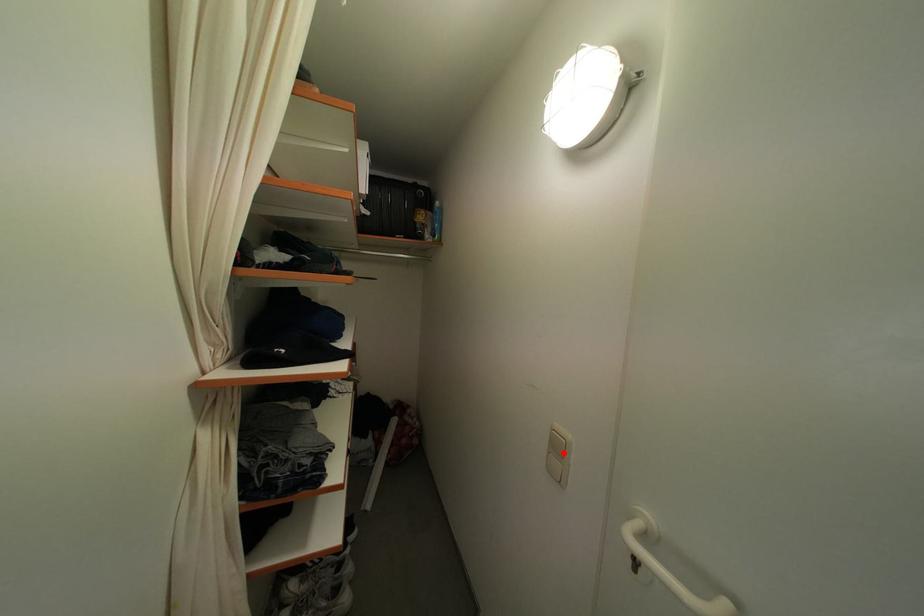
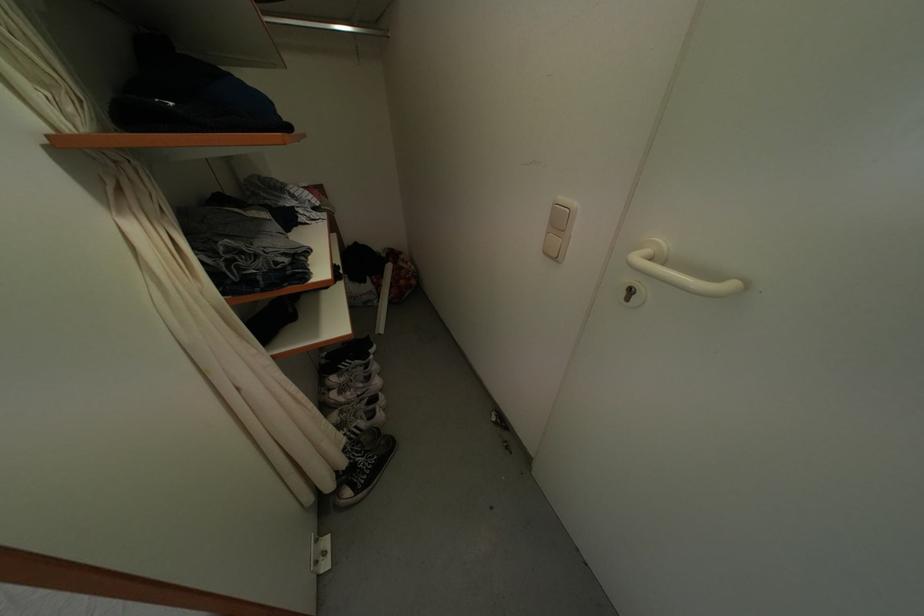
Question: I am providing you with two images of the same scene from different viewpoints. A red point is shown in image1. For the corresponding object point in image2, is it positioned nearer or farther from the camera?

Choices:
 (A) Nearer
 (B) Farther

Answer: (A)